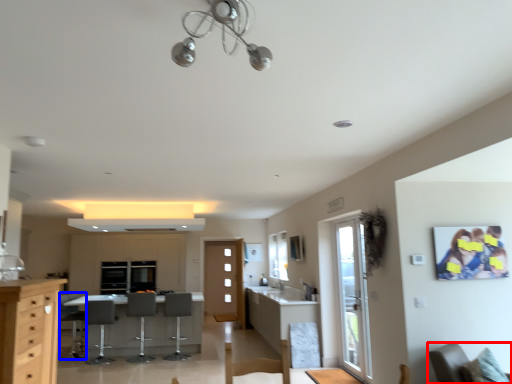
Question: Which of the following is the farthest to the observer, chair (highlighted by a red box) or armchair (highlighted by a blue box)?

Choices:
 (A) chair
 (B) armchair

Answer: (B)